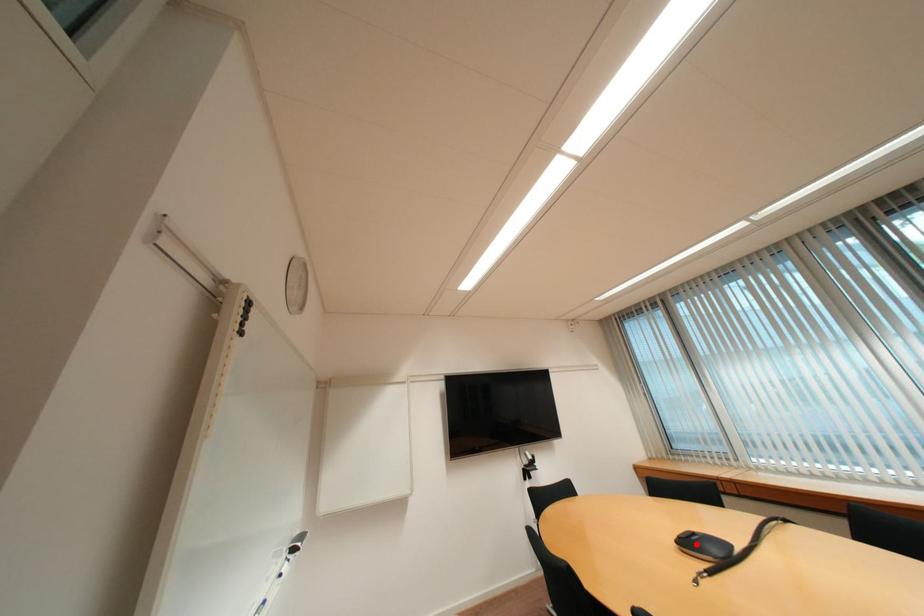
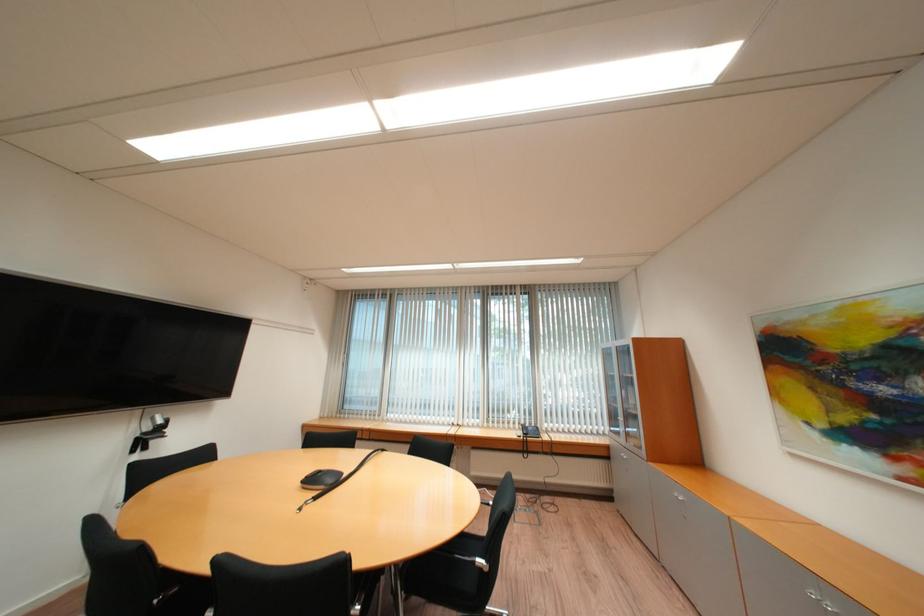
The point at the highlighted location is marked in the first image. Where is the corresponding point in the second image?

(320, 482)